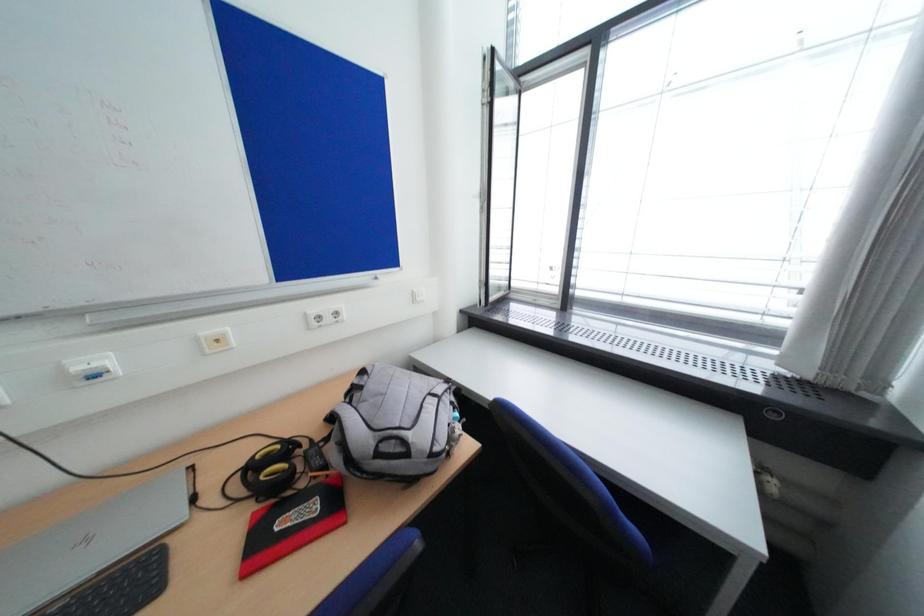
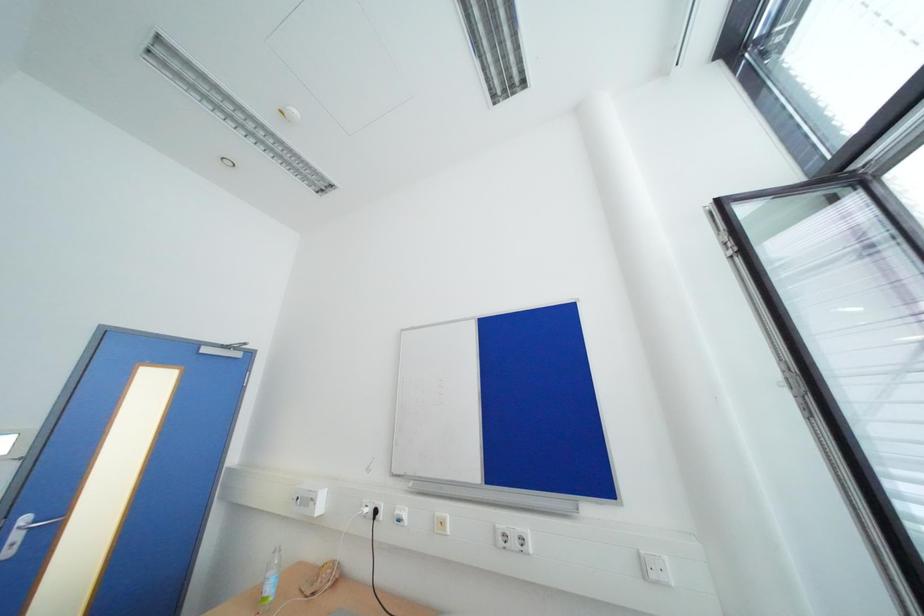
The first image is from the beginning of the video and the second image is from the end. How did the camera likely rotate when shooting the video?

The camera rotated toward left-up.